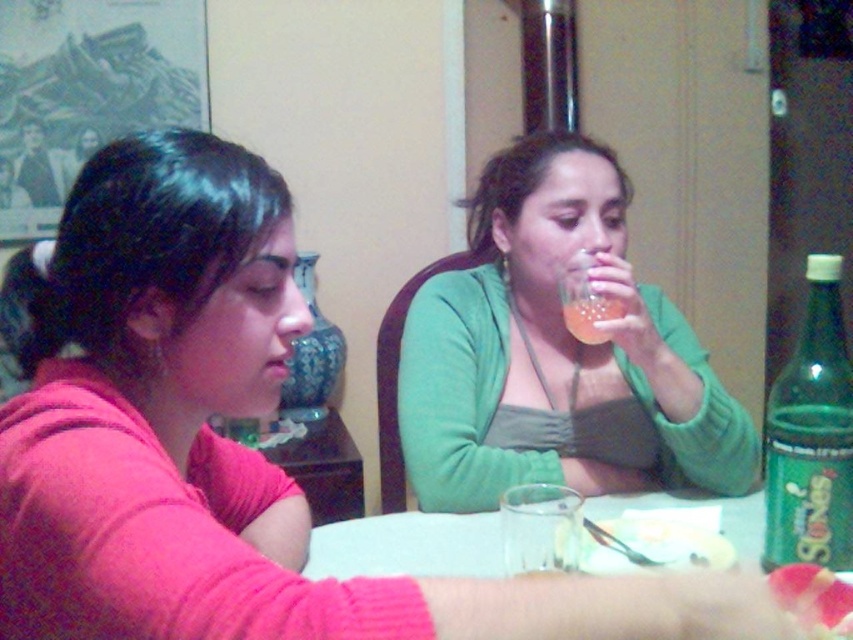
You are a person sitting at the table. You want to place a book on the white plastic table at lower center. However, there is a translucent plastic cup at upper center on the table. Will the cup interfere with placing the book?

The white plastic table at lower center is not as tall as the translucent plastic cup at upper center, meaning the cup is taller than the table. Therefore, placing the book on the table might be difficult because the cup could obstruct the space.

You are sitting at the table and want to reach for an item located at point (413,458). Which direction should you move your hand to reach it from point (634,500)?

To reach the item at point (413,458) from point (634,500), you should move your hand to the left and downward since point (413,458) is behind point (634,500).

You are a delivery robot that is 12 inches wide. You need to move from the entrance to the white plastic table at lower center without bumping into the translucent plastic cup at upper center. Can you safely navigate the space between them?

The distance between the white plastic table at lower center and the translucent plastic cup at upper center is 13.17 inches. Since the robot is 12 inches wide, there is enough space to safely navigate between them without collision.